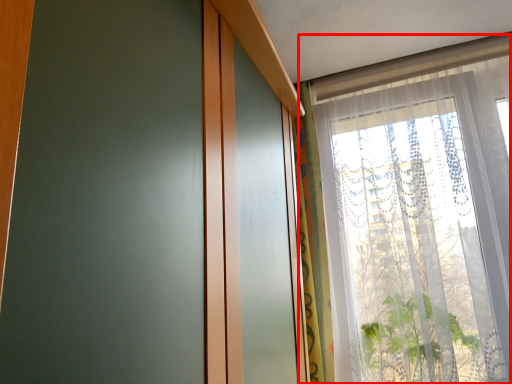
Question: From the image, what is the correct spatial relationship of window (annotated by the red box) in relation to curtain?

Choices:
 (A) right
 (B) left

Answer: (A)